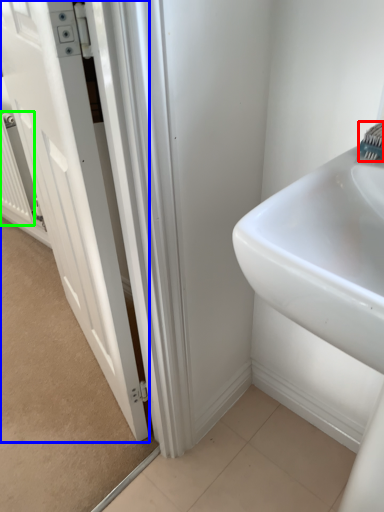
Question: Estimate the real-world distances between objects in this image. Which object is farther from brush (highlighted by a red box), door (highlighted by a blue box) or radiator (highlighted by a green box)?

Choices:
 (A) door
 (B) radiator

Answer: (B)